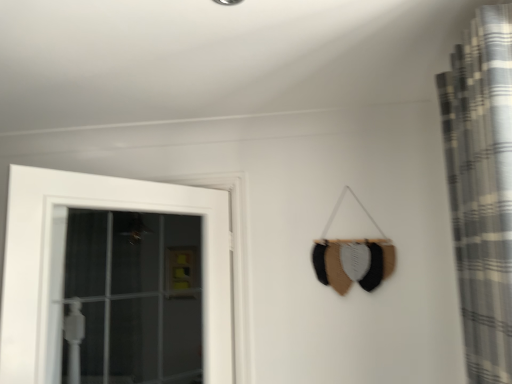
Question: Considering the positions of white wooden door at left and plaid fabric curtain at right in the image, is white wooden door at left wider or thinner than plaid fabric curtain at right?

Choices:
 (A) wide
 (B) thin

Answer: (B)

Question: Based on their sizes in the image, would you say white wooden door at left is bigger or smaller than plaid fabric curtain at right?

Choices:
 (A) big
 (B) small

Answer: (B)

Question: Is white wooden door at left in front of or behind plaid fabric curtain at right in the image?

Choices:
 (A) behind
 (B) front

Answer: (A)

Question: From their relative heights in the image, would you say plaid fabric curtain at right is taller or shorter than white wooden door at left?

Choices:
 (A) tall
 (B) short

Answer: (A)

Question: Based on their sizes in the image, would you say plaid fabric curtain at right is bigger or smaller than white wooden door at left?

Choices:
 (A) big
 (B) small

Answer: (A)

Question: Do you think plaid fabric curtain at right is within white wooden door at left, or outside of it?

Choices:
 (A) inside
 (B) outside

Answer: (B)

Question: From the image's perspective, is plaid fabric curtain at right located above or below white wooden door at left?

Choices:
 (A) above
 (B) below

Answer: (A)